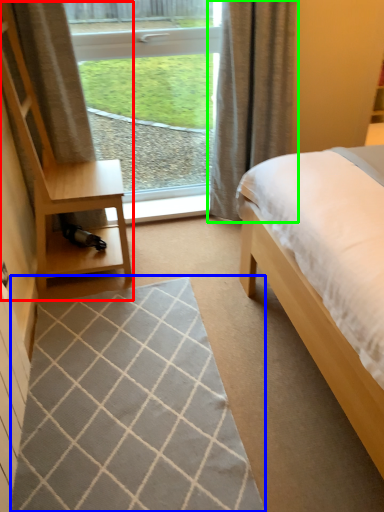
Question: Considering the real-world distances, which object is farthest from dresser (highlighted by a red box)? mat (highlighted by a blue box) or curtain (highlighted by a green box)?

Choices:
 (A) mat
 (B) curtain

Answer: (B)